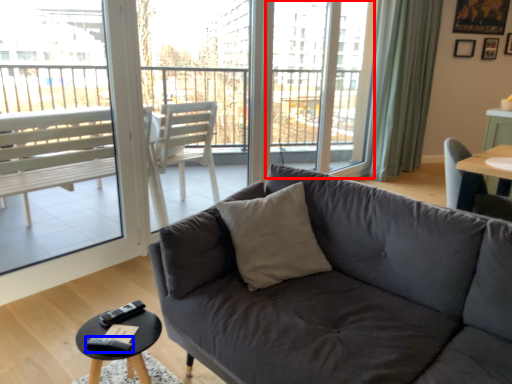
Question: Among these objects, which one is farthest to the camera, screen door (highlighted by a red box) or remote (highlighted by a blue box)?

Choices:
 (A) screen door
 (B) remote

Answer: (A)